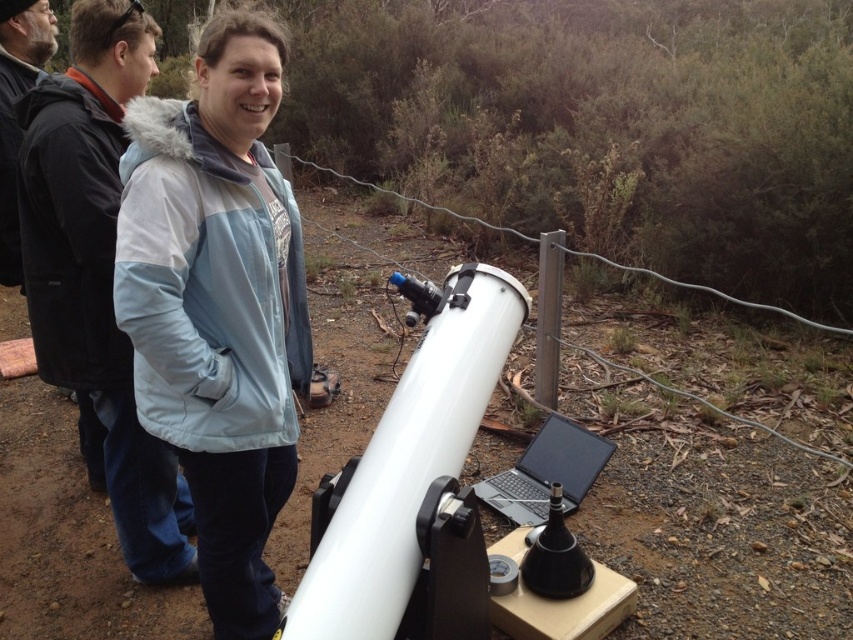
Can you confirm if white matte telescope at center is wider than black fuzzy jacket at left?

Yes, white matte telescope at center is wider than black fuzzy jacket at left.

Is white matte telescope at center taller than black fuzzy jacket at left?

No.

Which is behind, point (431, 500) or point (0, 268)?

Positioned behind is point (0, 268).

This screenshot has height=640, width=853. Identify the location of white matte telescope at center. (415, 486).

In the scene shown: Which of these two, light blue puffy jacket at center or white matte telescope at center, stands taller?

Standing taller between the two is light blue puffy jacket at center.

Measure the distance between point (184, 228) and camera.

The distance of point (184, 228) from camera is 4.77 feet.

You are a GUI agent. You are given a task and a screenshot of the screen. Output one action in this format:
    pyautogui.click(x=<x>, y=<y>)
    Task: Click on the light blue puffy jacket at center
    
    Given the screenshot: What is the action you would take?
    pyautogui.click(x=218, y=307)

The height and width of the screenshot is (640, 853). Describe the element at coordinates (96, 272) in the screenshot. I see `black fleece jacket at upper left` at that location.

Describe the element at coordinates (96, 272) in the screenshot. This screenshot has width=853, height=640. I see `black fleece jacket at upper left` at that location.

Where is `black fleece jacket at upper left`? This screenshot has height=640, width=853. black fleece jacket at upper left is located at coordinates (96, 272).